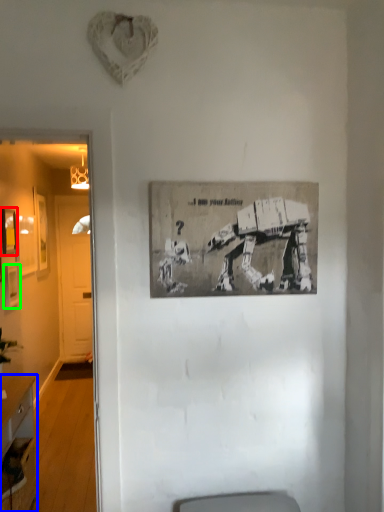
Question: Based on their relative distances, which object is farther from picture frame (highlighted by a red box)? Choose from desk (highlighted by a blue box) and picture frame (highlighted by a green box).

Choices:
 (A) desk
 (B) picture frame

Answer: (A)